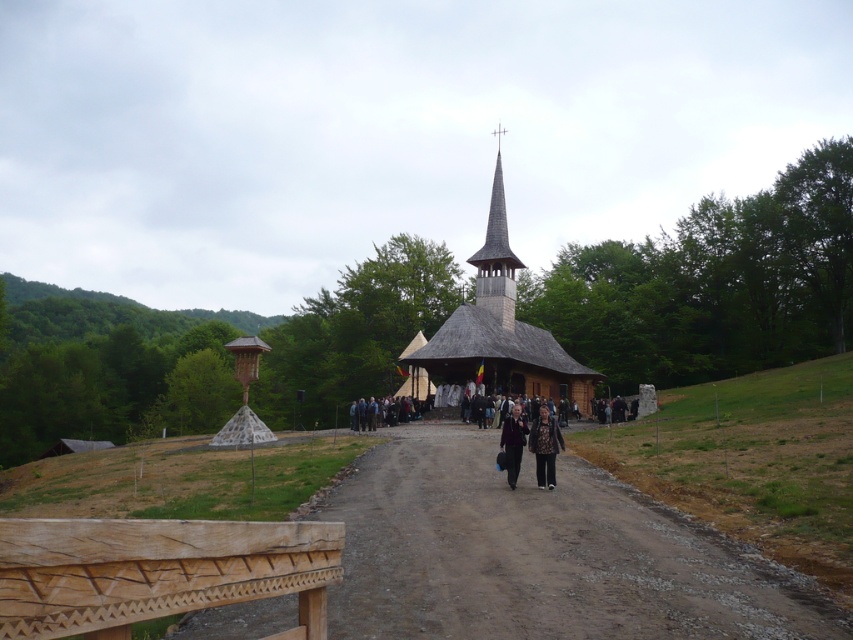
Based on the photo, is wooden church at center to the left of dark brown leather jacket at center from the viewer's perspective?

Incorrect, wooden church at center is not on the left side of dark brown leather jacket at center.

You are a GUI agent. You are given a task and a screenshot of the screen. Output one action in this format:
    pyautogui.click(x=<x>, y=<y>)
    Task: Click on the wooden church at center
    This screenshot has height=640, width=853.
    Given the screenshot: What is the action you would take?
    (x=502, y=330)

Is point (479, 328) positioned after point (508, 461)?

Yes, point (479, 328) is behind point (508, 461).

Image resolution: width=853 pixels, height=640 pixels. I want to click on wooden church at center, so click(x=502, y=330).

Is wooden church at center above patterned fabric coat at center?

Yes, wooden church at center is above patterned fabric coat at center.

What do you see at coordinates (502, 330) in the screenshot?
I see `wooden church at center` at bounding box center [502, 330].

Where is `wooden church at center`? Image resolution: width=853 pixels, height=640 pixels. wooden church at center is located at coordinates (502, 330).

Which is more to the left, wooden spire at center or patterned fabric coat at center?

patterned fabric coat at center

Does point (492, 296) lie in front of point (556, 424)?

No, it is not.

At what (x,y) coordinates should I click in order to perform the action: click on wooden spire at center. Please return your answer as a coordinate pair (x, y). Looking at the image, I should click on (496, 257).